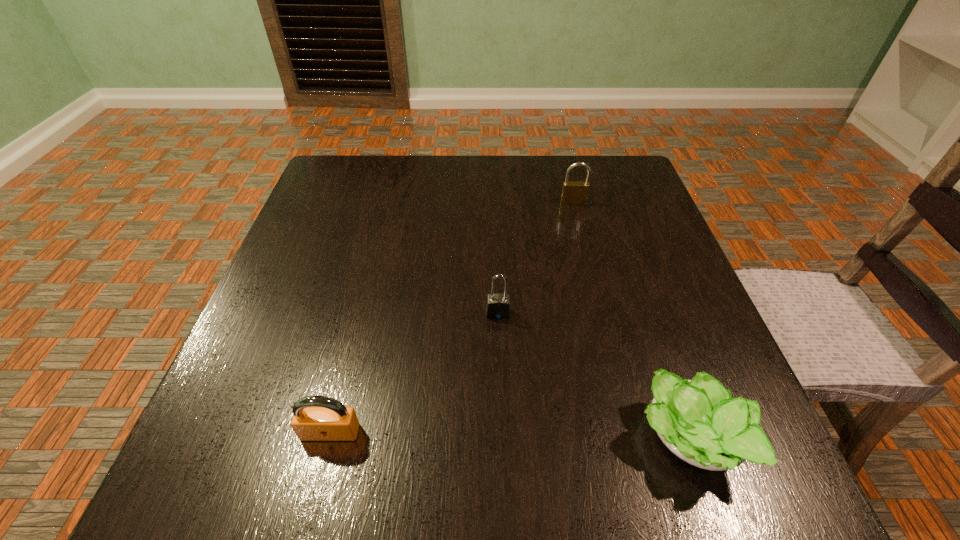
Where is `object at the far edge`? Image resolution: width=960 pixels, height=540 pixels. object at the far edge is located at coordinates (573, 192).

Where is `padlock located in the near edge section of the desktop`? The image size is (960, 540). padlock located in the near edge section of the desktop is located at coordinates (315, 418).

Find the location of a particular element. The image size is (960, 540). lettuce that is at the near edge is located at coordinates (699, 422).

Where is `object located at the left edge`? This screenshot has width=960, height=540. object located at the left edge is located at coordinates (315, 418).

Locate an element on the screen. This screenshot has width=960, height=540. padlock that is at the right edge is located at coordinates (573, 192).

You are a GUI agent. You are given a task and a screenshot of the screen. Output one action in this format:
    pyautogui.click(x=<x>, y=<y>)
    Task: Click on the lettuce situated at the right edge
    
    Given the screenshot: What is the action you would take?
    pyautogui.click(x=699, y=422)

Find the location of a particular element. object that is at the near left corner is located at coordinates (315, 418).

Locate an element on the screen. object situated at the far right corner is located at coordinates (573, 192).

Identify the location of object present at the near right corner. This screenshot has height=540, width=960. (699, 422).

In order to click on vacant space at the far edge of the desktop in this screenshot , I will do `click(489, 183)`.